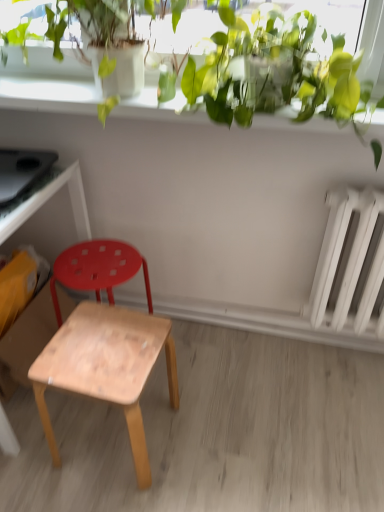
Identify the location of free space underneath white matte radiator at right (from a real-world perspective). (335, 355).